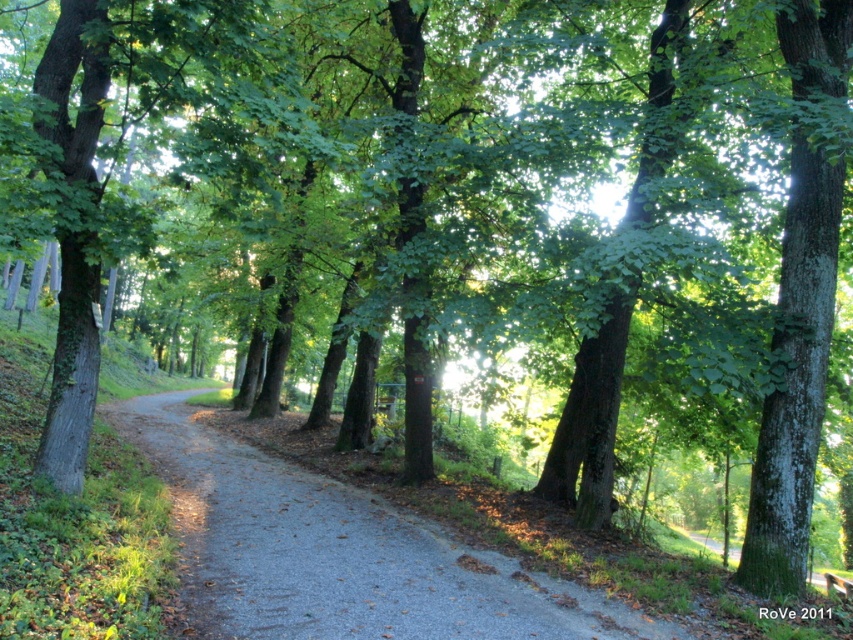
Based on the photo, who is taller, gray gravel path at center or green rough bark tree at right?

green rough bark tree at right

Which is above, gray gravel path at center or green rough bark tree at right?

green rough bark tree at right is above.

Describe the element at coordinates (339, 554) in the screenshot. I see `gray gravel path at center` at that location.

The height and width of the screenshot is (640, 853). I want to click on gray gravel path at center, so click(x=339, y=554).